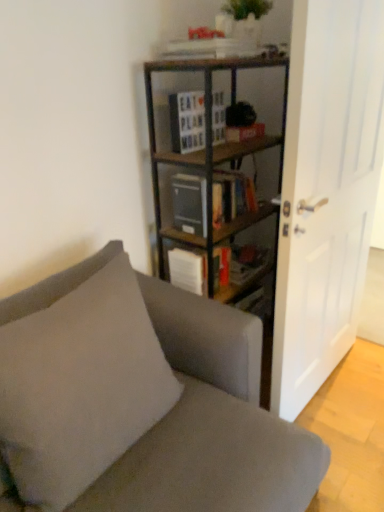
Question: From the image's perspective, is wooden bookshelf at center above or below white matte door at right?

Choices:
 (A) above
 (B) below

Answer: (B)

Question: Based on their positions, is wooden bookshelf at center located to the left or right of white matte door at right?

Choices:
 (A) left
 (B) right

Answer: (A)

Question: Estimate the real-world distances between objects in this image. Which object is farther from the matte gray bookshelf at center, which appears as the first book when ordered from the bottom?

Choices:
 (A) wooden sign at center, the 2th book ordered from the bottom
 (B) wooden bookcase at center
 (C) fabric couch at center
 (D) white matte door at right
 (E) wooden bookshelf at center

Answer: (C)

Question: Which is farther from the wooden sign at center, the 2th book ordered from the bottom?

Choices:
 (A) fabric couch at center
 (B) wooden bookcase at center
 (C) wooden bookshelf at center
 (D) matte gray bookshelf at center, which appears as the first book when ordered from the bottom
 (E) white matte door at right

Answer: (A)